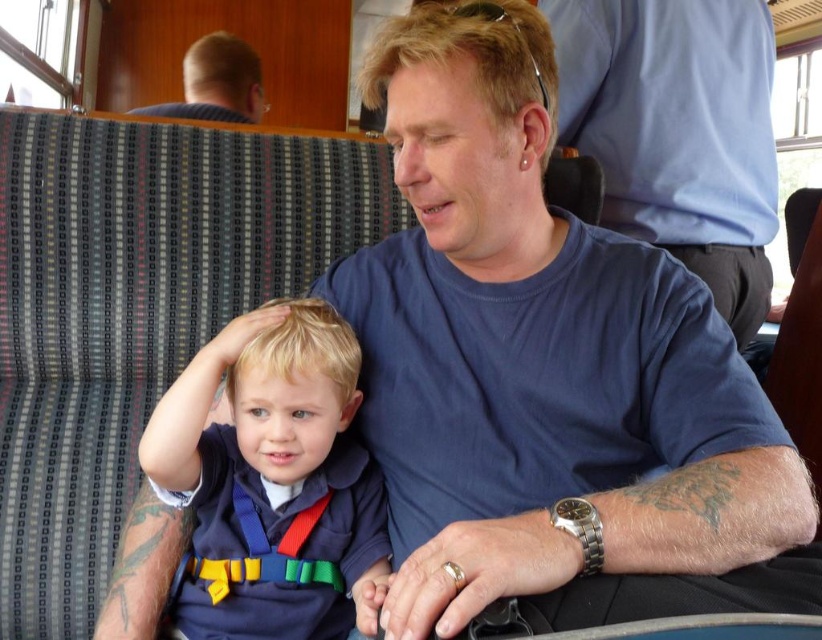
Question: Estimate the real-world distances between objects in this image. Which object is closer to the blue cotton shirt at upper center?

Choices:
 (A) blonde hair at upper left
 (B) blue fabric shirt at center

Answer: (B)

Question: Which of the following is the closest to the observer?

Choices:
 (A) (238, 104)
 (B) (564, 72)
 (C) (246, 600)

Answer: (C)

Question: Where is blue fabric shirt at center located in relation to blonde hair at upper left in the image?

Choices:
 (A) above
 (B) below

Answer: (B)

Question: Which of the following is the closest to the observer?

Choices:
 (A) (672, 8)
 (B) (312, 355)
 (C) (252, 84)

Answer: (B)

Question: Can you confirm if blue fabric shirt at center is thinner than blonde hair at upper left?

Choices:
 (A) no
 (B) yes

Answer: (B)

Question: Is blue fabric shirt at center positioned behind blonde hair at upper left?

Choices:
 (A) no
 (B) yes

Answer: (A)